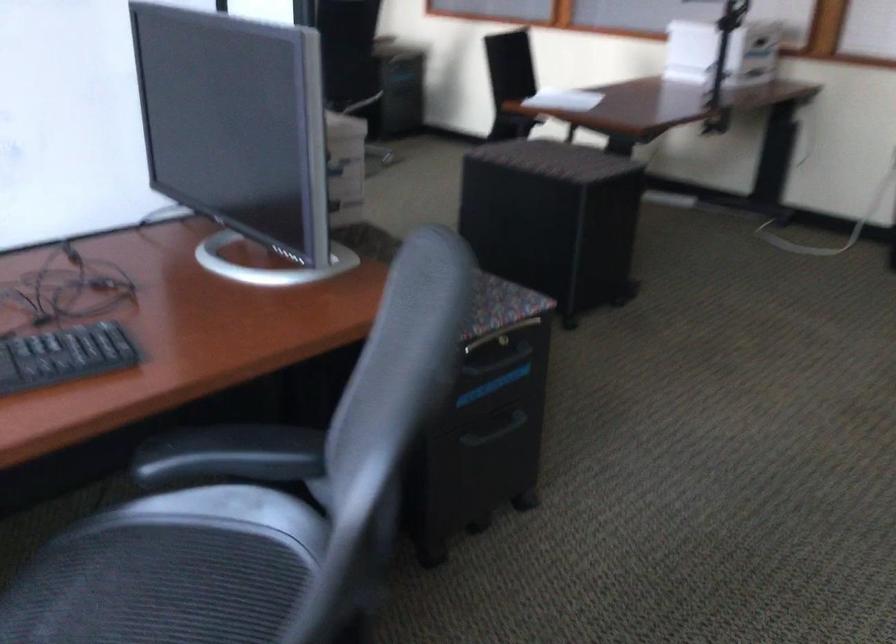
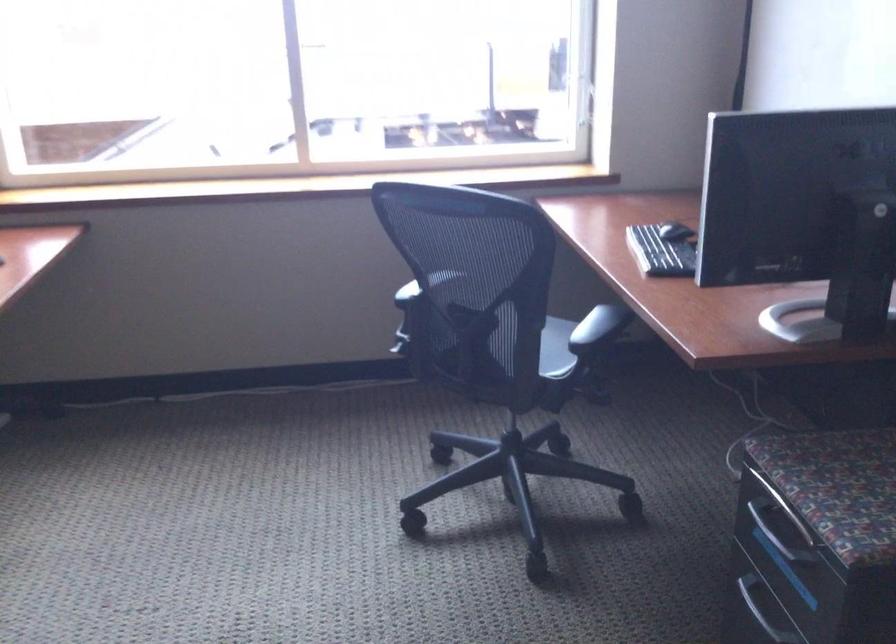
Find the pixel in the second image that matches pixel 487 371 in the first image.

(776, 532)